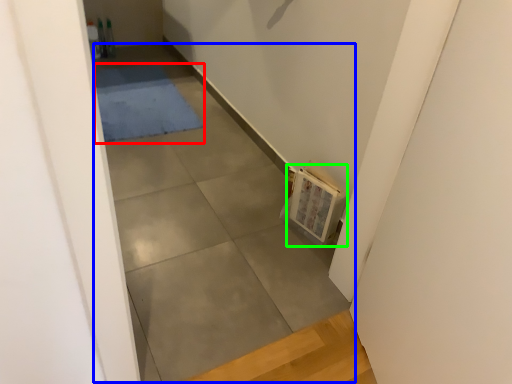
Question: Based on their relative distances, which object is nearer to mat (highlighted by a red box)? Choose from concrete (highlighted by a blue box) and book (highlighted by a green box).

Choices:
 (A) concrete
 (B) book

Answer: (A)